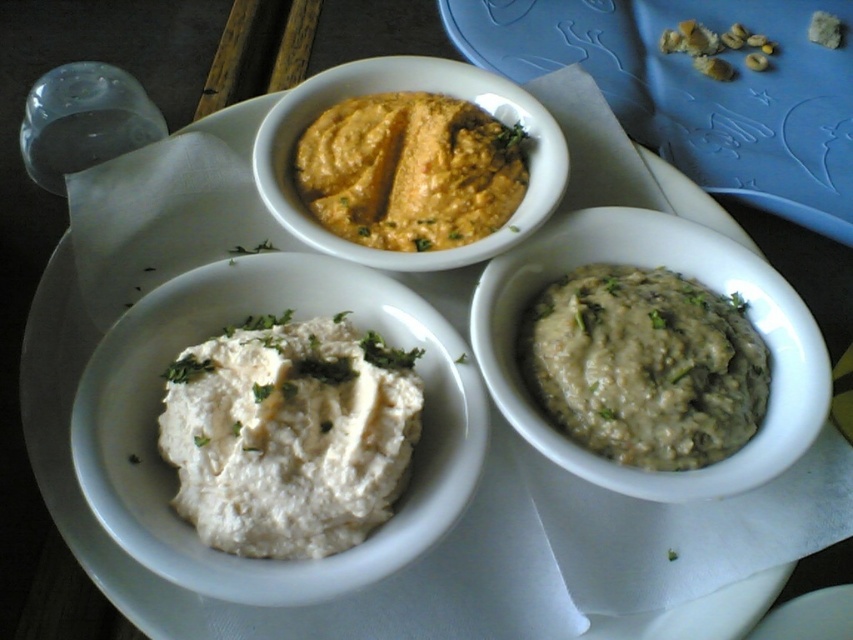
Question: Based on their relative distances, which object is nearer to the white creamy paste at bottom right?

Choices:
 (A) orange matte hummus at upper center
 (B) white creamy dip at center
 (C) orange matte hummus at center

Answer: (C)

Question: Can you confirm if orange matte hummus at upper center is smaller than white creamy dip at center?

Choices:
 (A) yes
 (B) no

Answer: (B)

Question: Which point is farther to the camera?

Choices:
 (A) (143, 435)
 (B) (486, 61)
 (C) (187, 380)

Answer: (B)

Question: Is white matte hummus at lower left below white matte bowl at lower right?

Choices:
 (A) no
 (B) yes

Answer: (B)

Question: Is orange matte hummus at upper center thinner than white creamy dip at center?

Choices:
 (A) yes
 (B) no

Answer: (B)

Question: Which of the following is the closest to the observer?

Choices:
 (A) (163, 452)
 (B) (846, 10)
 (C) (711, 381)
 (D) (496, 298)

Answer: (A)